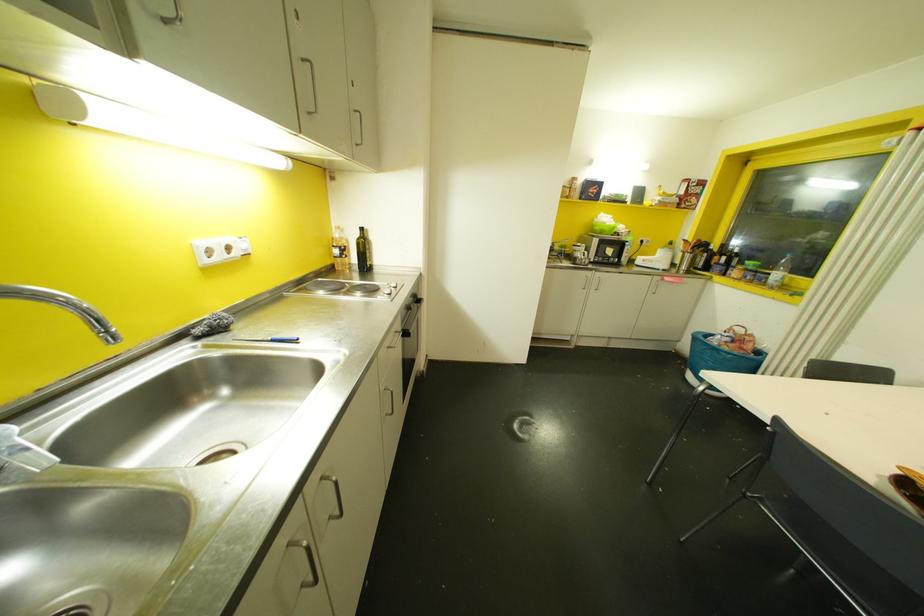
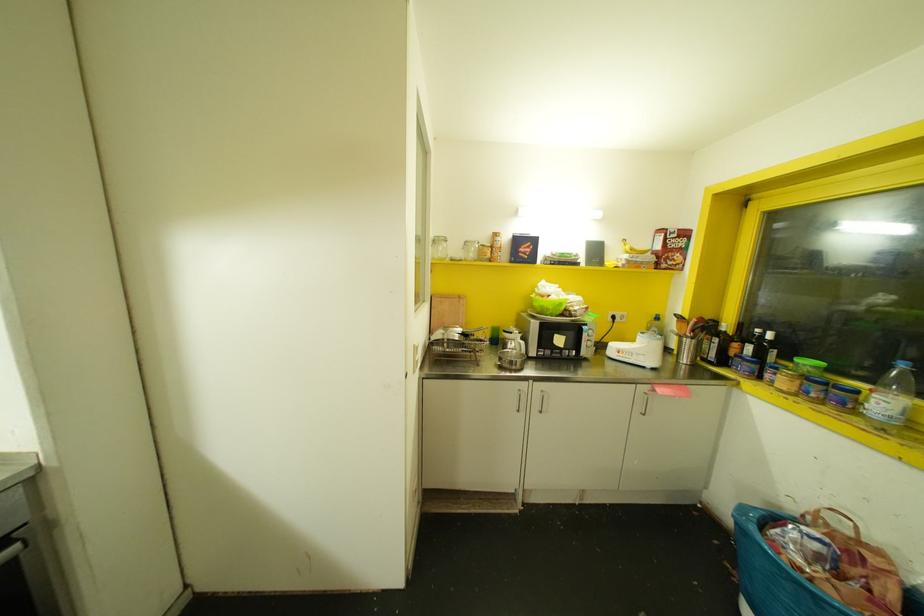
The point at (715, 257) is marked in the first image. Where is the corresponding point in the second image?

(735, 345)